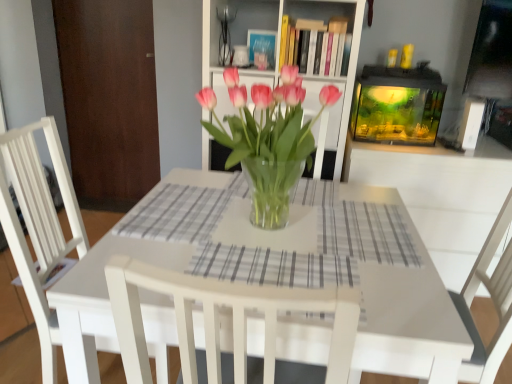
Find the location of `free point above white glossy table at center (from a real-world perspective)`. free point above white glossy table at center (from a real-world perspective) is located at coordinates [275, 234].